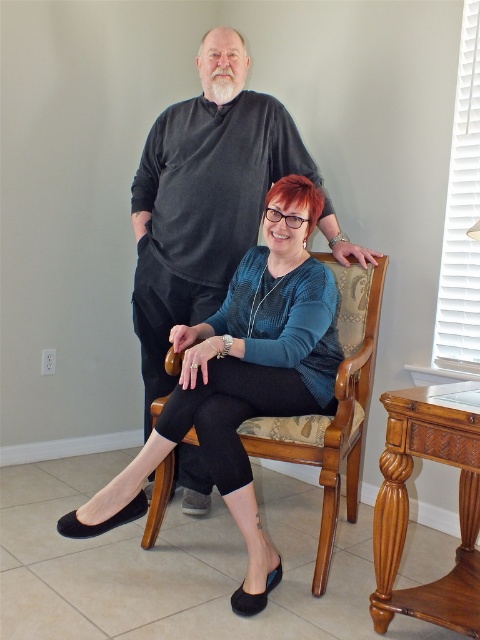
Question: In this image, where is dark gray sweater at center located relative to wooden armchair at center?

Choices:
 (A) left
 (B) right

Answer: (A)

Question: Which point is closer to the camera?

Choices:
 (A) dark gray sweater at center
 (B) wooden armchair at center

Answer: (B)

Question: Does dark gray sweater at center appear over wooden armchair at center?

Choices:
 (A) no
 (B) yes

Answer: (B)

Question: Is dark gray sweater at center to the left of wooden armchair at center from the viewer's perspective?

Choices:
 (A) no
 (B) yes

Answer: (B)

Question: Which of the following is the closest to the observer?

Choices:
 (A) wooden armchair at center
 (B) dark gray sweater at center

Answer: (A)

Question: Which of the following is the farthest from the observer?

Choices:
 (A) wooden armchair at center
 (B) dark gray sweater at center

Answer: (B)